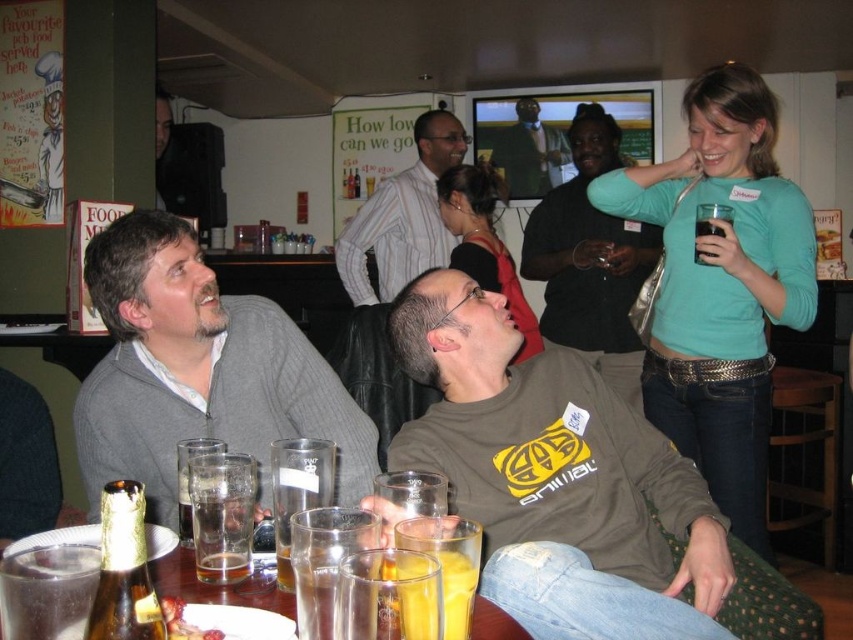
Looking at this image, you are a customer at the pub and want to grab the gold foil beer bottle at lower left. However, the dark brown leather jacket at upper center is blocking your path. Can you reach the beer bottle without moving the jacket?

The gold foil beer bottle at lower left is behind the dark brown leather jacket at upper center, so you cannot reach it without moving the jacket.